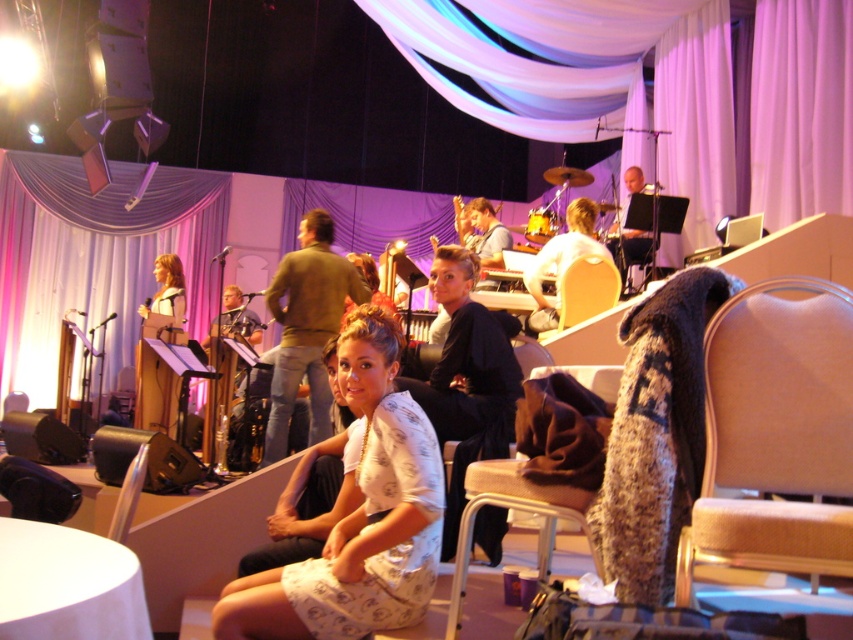
You are an event organizer who needs to ensure that the black matte jacket at center can be placed on the beige fabric chair at center without falling off. Based on the scene description, will the jacket fit properly on the chair?

The beige fabric chair at center is smaller than black matte jacket at center, so the jacket may not fit properly and could fall off when placed on the chair.

You are standing in the center of the stage at the lively indoor event. You need to move to the brown fabric chair at lower right. According to the coordinates provided, in which direction should you move first to reach it?

The brown fabric chair at lower right is located at coordinates point (x=515, y=509). Since you are at the center of the stage, you should move towards the right and slightly downward to reach the brown fabric chair at lower right.

You are an event planner arranging a small gathering in this venue. You need to place a rectangular table that is 1.5 meters wide between the beige fabric chair at center and the smooth black drum set at upper right. Based on their widths, will there be enough space to fit the table between them?

The beige fabric chair at center has a lesser width compared to the smooth black drum set at upper right. Since the table is 1.5 meters wide, and the total available space between them must be at least 1.5 meters, but the exact spacing isn